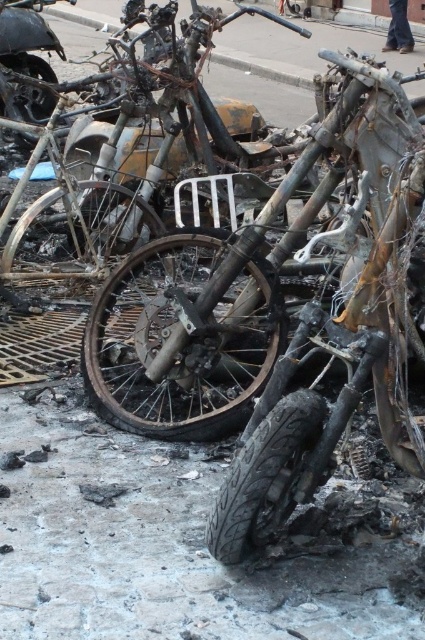
You are a firefighter assessing the scene of a fire. You see a burnt metallic bicycle at center and a charred metal motorcycle at upper left. Which object is positioned to the right of the other?

The burnt metallic bicycle at center is positioned to the right of the charred metal motorcycle at upper left.

You are a firefighter assessing the scene after a fire. You notice two items of interest in the debris. The first is the charcoal matte bicycle at center, and the second is the charcoal rubber tire at lower center. From your vantage point, which of these two objects is positioned to the left?

The charcoal matte bicycle at center is positioned to the left of the charcoal rubber tire at lower center.

You are a firefighter assessing the damage after a fire. You see a burnt metallic bicycle at center and a charcoal rubber tire at lower center. Which object is wider?

The burnt metallic bicycle at center is wider than the charcoal rubber tire at lower center.